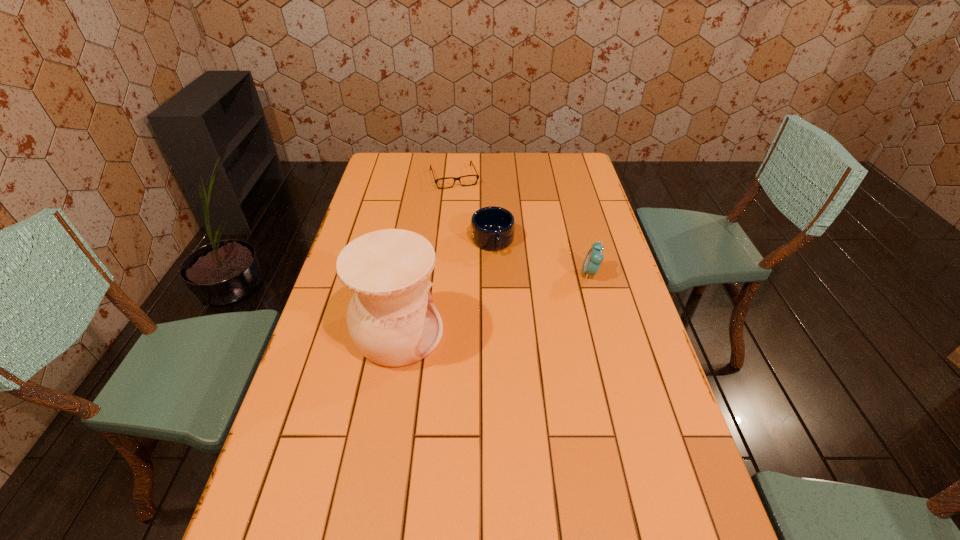
Find the location of a particular element. This screenshot has height=540, width=960. vacant space that satisfies the following two spatial constraints: 1. on the front side of the second shortest object; 2. on the face of the alarm clock is located at coordinates (493, 273).